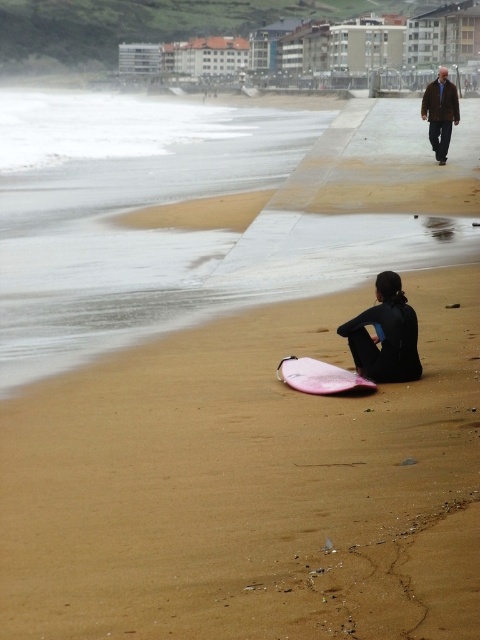
Does black matte wetsuit at lower center have a greater width compared to pink matte surfboard at center?

Incorrect, black matte wetsuit at lower center's width does not surpass pink matte surfboard at center's.

Who is more forward, (x=402, y=348) or (x=296, y=369)?

Point (x=402, y=348) is in front.

Where is `black matte wetsuit at lower center`? black matte wetsuit at lower center is located at coordinates (384, 342).

Between point (360, 355) and point (432, 113), which one is positioned in front?

Positioned in front is point (360, 355).

At what (x,y) coordinates should I click in order to perform the action: click on black matte wetsuit at lower center. Please return your answer as a coordinate pair (x, y). Looking at the image, I should click on (384, 342).

This screenshot has width=480, height=640. Describe the element at coordinates (384, 342) in the screenshot. I see `black matte wetsuit at lower center` at that location.

Identify the location of black matte wetsuit at lower center. This screenshot has height=640, width=480. (384, 342).

Between point (351, 381) and point (454, 86), which one is positioned in front?

Point (351, 381) is more forward.

Between pink matte surfboard at center and dark brown leather jacket at upper right, which one has less height?

Standing shorter between the two is pink matte surfboard at center.

Is point (304, 358) closer to viewer compared to point (437, 88)?

Yes, it is.

At what (x,y) coordinates should I click in order to perform the action: click on pink matte surfboard at center. Please return your answer as a coordinate pair (x, y). This screenshot has height=640, width=480. Looking at the image, I should click on (320, 376).